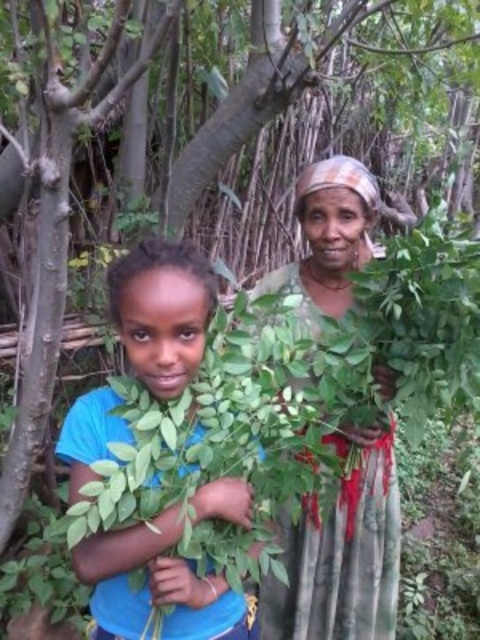
Is blue fabric shirt at center positioned behind green fabric dress at center?

That is False.

Which of these two, blue fabric shirt at center or green fabric dress at center, stands shorter?

With less height is green fabric dress at center.

Between point (194, 497) and point (332, 275), which one is positioned behind?

The point (332, 275) is behind.

Find the location of a particular element. blue fabric shirt at center is located at coordinates (157, 586).